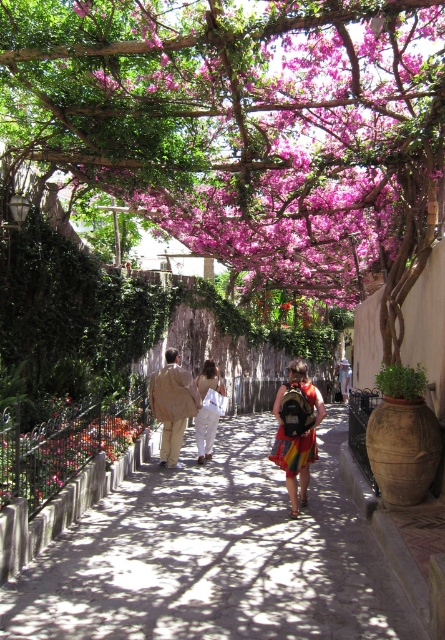
You are standing in the alleyway and see a point marked at coordinates (67, 445). According to the scene, which object is this point located on?

The point at coordinates (67, 445) is located on the floral patterned vase at lower left.